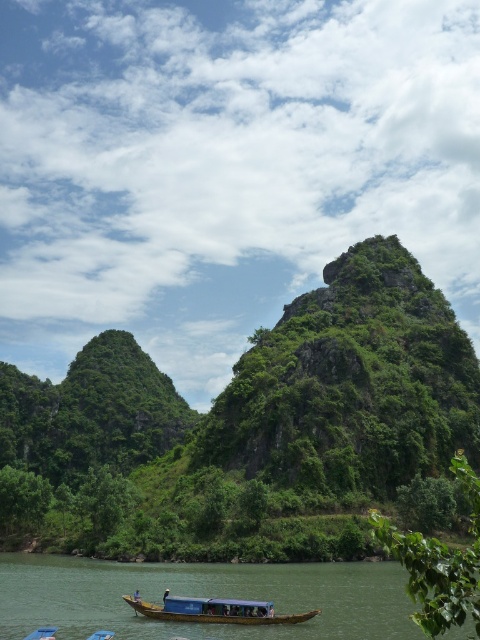
What can be found at the coordinates point (253, 432) in the image?

At point (253, 432) lies green leafy vegetation at center.

You are a photographer planning to capture a photo of the green leafy vegetation at center and the blue wooden boat at lower center. Based on their sizes in the image, which object would appear larger in your photo?

The green leafy vegetation at center appears larger in the photo because it is taller than the blue wooden boat at lower center.

You are a tourist standing on the lakeside and want to take a boat ride. You see two boats available for rent, the green wooden boat at lower center and the blue wooden boat at lower center. Which boat would you choose if you prefer a larger vessel?

The green wooden boat at lower center is bigger than the blue wooden boat at lower center, so you should choose the green wooden boat at lower center.